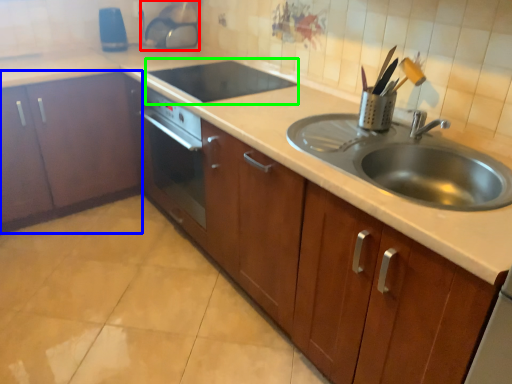
Question: Which object is positioned farthest from appliance (highlighted by a red box)? Select from cabinetry (highlighted by a blue box) and appliance (highlighted by a green box).

Choices:
 (A) cabinetry
 (B) appliance

Answer: (A)